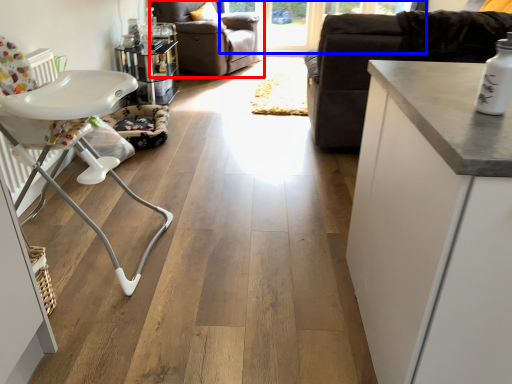
Question: Which object is further to the camera taking this photo, chair (highlighted by a red box) or window screen (highlighted by a blue box)?

Choices:
 (A) chair
 (B) window screen

Answer: (B)